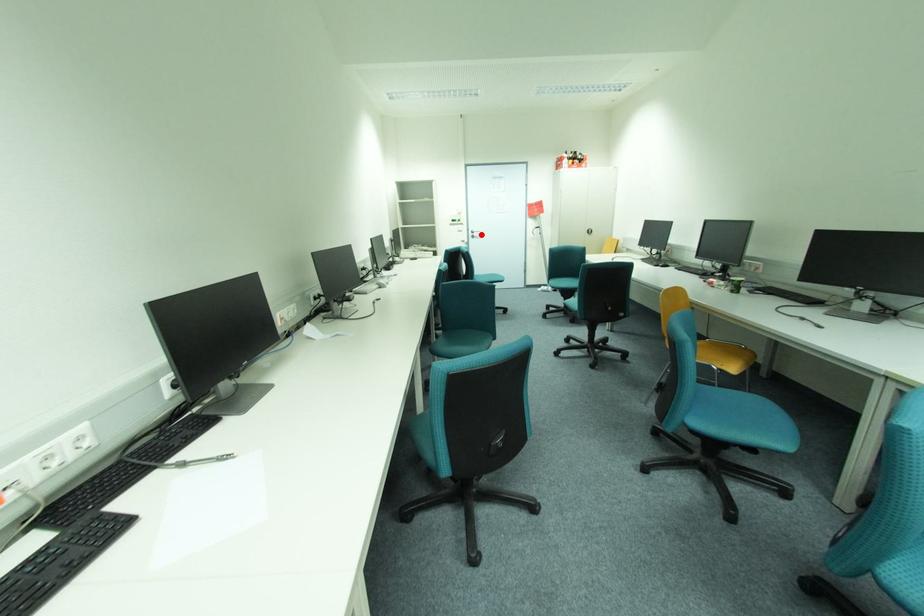
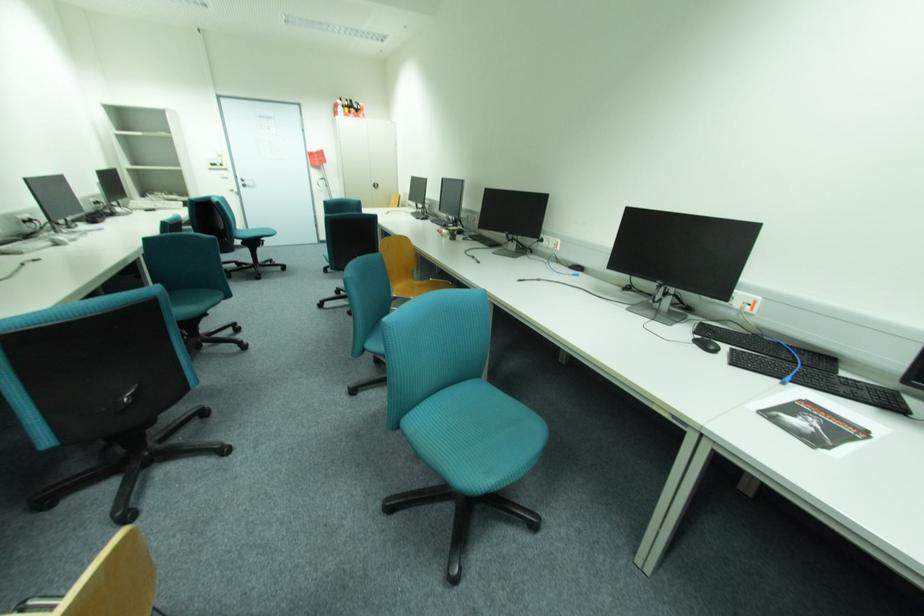
In the second image, find the point that corresponds to the highlighted location in the first image.

(253, 183)